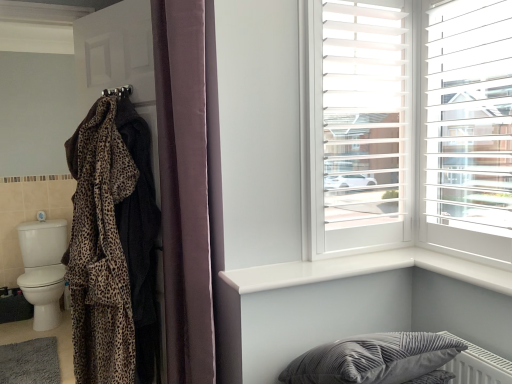
You are a GUI agent. You are given a task and a screenshot of the screen. Output one action in this format:
    pyautogui.click(x=<x>, y=<y>)
    Task: Click on the empty space that is ontop of white glossy window sill at upper right
    The image size is (512, 384).
    Given the screenshot: What is the action you would take?
    pyautogui.click(x=313, y=262)